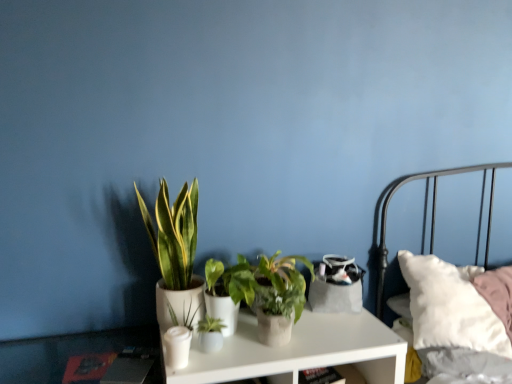
Question: Is green matte plant at center in front of or behind green matte plant at center, the 3th houseplant viewed from the left, in the image?

Choices:
 (A) front
 (B) behind

Answer: (B)

Question: Is point (173, 316) positioned closer to the camera than point (245, 286)?

Choices:
 (A) closer
 (B) farther

Answer: (B)

Question: Which object is the farthest from the green matte plant at center?

Choices:
 (A) green matte plant at center, which ranks as the 3th houseplant in right-to-left order
 (B) green matte plant at center, the 2th houseplant in the right-to-left sequence
 (C) green glossy plant at center, which ranks as the first houseplant in left-to-right order
 (D) green matte plant at center, which is counted as the first houseplant, starting from the right
 (E) white matte nightstand at center

Answer: (E)

Question: Considering the real-world distances, which object is closest to the green matte plant at center, the 2th houseplant when ordered from left to right?

Choices:
 (A) green glossy plant at center, which ranks as the first houseplant in left-to-right order
 (B) green matte plant at center
 (C) white matte nightstand at center
 (D) green matte plant at center, which is counted as the first houseplant, starting from the right
 (E) green matte plant at center, the 2th houseplant in the right-to-left sequence

Answer: (B)